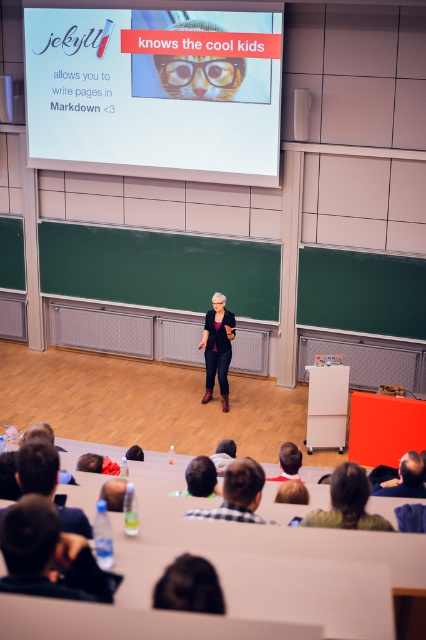
Question: Which object is positioned closest to the plaid shirt at lower center?

Choices:
 (A) matte black blazer at center
 (B) black leather jacket at lower left
 (C) dark brown leather jacket at lower right
 (D) dark brown hair at lower left

Answer: (D)

Question: Which object appears farthest from the camera in this image?

Choices:
 (A) dark brown hair at lower left
 (B) dark brown leather jacket at lower right

Answer: (B)

Question: Does white matte projection screen at upper center have a larger size compared to dark brown leather jacket at lower right?

Choices:
 (A) no
 (B) yes

Answer: (B)

Question: Can you confirm if white matte projection screen at upper center is bigger than matte black blazer at center?

Choices:
 (A) no
 (B) yes

Answer: (B)

Question: Which object is closer to the camera taking this photo?

Choices:
 (A) black leather jacket at lower left
 (B) dark brown hair at lower left
 (C) dark brown leather jacket at lower right

Answer: (A)

Question: Observing the image, what is the correct spatial positioning of black leather jacket at lower left in reference to dark brown hair at lower left?

Choices:
 (A) above
 (B) below

Answer: (B)